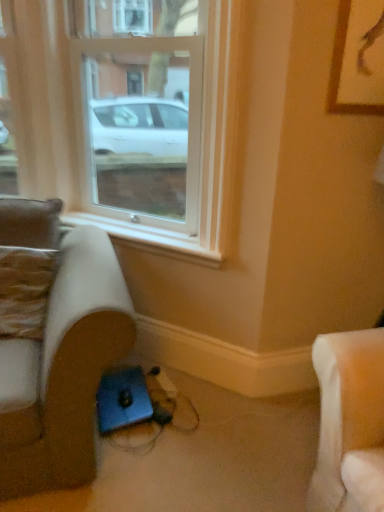
Find the location of a particular element. The width and height of the screenshot is (384, 512). suede-like beige studio couch at lower left is located at coordinates (63, 370).

The height and width of the screenshot is (512, 384). Describe the element at coordinates (150, 238) in the screenshot. I see `white plastic window sill at lower center` at that location.

Image resolution: width=384 pixels, height=512 pixels. Describe the element at coordinates (358, 59) in the screenshot. I see `wooden framed picture at upper right` at that location.

I want to click on clear glass window at center, so click(126, 117).

Considering the relative positions of wooden framed picture at upper right and clear glass window at center in the image provided, is wooden framed picture at upper right to the left of clear glass window at center from the viewer's perspective?

Incorrect, wooden framed picture at upper right is not on the left side of clear glass window at center.

Could you tell me if wooden framed picture at upper right is turned towards clear glass window at center?

No, wooden framed picture at upper right is not oriented towards clear glass window at center.

Considering the sizes of objects wooden framed picture at upper right and clear glass window at center in the image provided, who is taller, wooden framed picture at upper right or clear glass window at center?

clear glass window at center.

Which of these two, leather-like brown pillow at left or wooden framed picture at upper right, is smaller?

wooden framed picture at upper right.

From the image's perspective, which one is positioned lower, leather-like brown pillow at left or wooden framed picture at upper right?

leather-like brown pillow at left, from the image's perspective.

From a real-world perspective, between leather-like brown pillow at left and wooden framed picture at upper right, who is vertically lower?

From a 3D spatial view, leather-like brown pillow at left is below.

Does leather-like brown pillow at left lie behind wooden framed picture at upper right?

Yes, leather-like brown pillow at left is behind wooden framed picture at upper right.

Would you say leather-like brown pillow at left is inside or outside clear glass window at center?

leather-like brown pillow at left lies outside clear glass window at center.

Considering the sizes of objects leather-like brown pillow at left and clear glass window at center in the image provided, who is shorter, leather-like brown pillow at left or clear glass window at center?

With less height is leather-like brown pillow at left.

This screenshot has height=512, width=384. What are the coordinates of `window that is on the right side of leather-like brown pillow at left` in the screenshot? It's located at (126, 117).

Does leather-like brown pillow at left have a lesser width compared to clear glass window at center?

Indeed, leather-like brown pillow at left has a lesser width compared to clear glass window at center.

Looking at this image, considering the relative sizes of clear glass window at center and leather-like brown pillow at left in the image provided, is clear glass window at center shorter than leather-like brown pillow at left?

No, clear glass window at center is not shorter than leather-like brown pillow at left.

Would you say clear glass window at center is to the left or to the right of leather-like brown pillow at left in the picture?

clear glass window at center is positioned on leather-like brown pillow at left's right side.

Does clear glass window at center have a greater width compared to leather-like brown pillow at left?

Yes, clear glass window at center is wider than leather-like brown pillow at left.

Considering the points (95, 156) and (4, 283), which point is in front, point (95, 156) or point (4, 283)?

The point (4, 283) is closer.

Are white plastic window sill at lower center and clear glass window at center making contact?

No, white plastic window sill at lower center is not touching clear glass window at center.

Measure the distance from white plastic window sill at lower center to clear glass window at center.

11.66 inches.

Consider the image. Considering the relative positions of white plastic window sill at lower center and clear glass window at center in the image provided, is white plastic window sill at lower center to the right of clear glass window at center from the viewer's perspective?

No.

Which point is more forward, (x=166, y=249) or (x=86, y=56)?

The point (x=166, y=249) is more forward.

Image resolution: width=384 pixels, height=512 pixels. In order to click on window above the suede-like beige studio couch at lower left (from a real-world perspective) in this screenshot , I will do coord(126,117).

Is suede-like beige studio couch at lower left facing away from clear glass window at center?

No, suede-like beige studio couch at lower left is not facing the opposite direction of clear glass window at center.

From a real-world perspective, is suede-like beige studio couch at lower left over clear glass window at center?

No, from a real-world perspective, suede-like beige studio couch at lower left is not above clear glass window at center.

Which object is positioned more to the right, suede-like beige studio couch at lower left or clear glass window at center?

From the viewer's perspective, clear glass window at center appears more on the right side.

Is suede-like beige studio couch at lower left inside or outside of white plastic window sill at lower center?

suede-like beige studio couch at lower left is spatially situated outside white plastic window sill at lower center.

From a real-world perspective, is suede-like beige studio couch at lower left physically located above or below white plastic window sill at lower center?

suede-like beige studio couch at lower left is below white plastic window sill at lower center.

Which of these two, suede-like beige studio couch at lower left or white plastic window sill at lower center, is wider?

With larger width is suede-like beige studio couch at lower left.

Where is `picture frame behind the clear glass window at center`? picture frame behind the clear glass window at center is located at coordinates (358, 59).

Locate an element on the screen. This screenshot has height=512, width=384. picture frame on the right of leather-like brown pillow at left is located at coordinates (358, 59).

Looking at this image, looking at the image, which one is located further to leather-like brown pillow at left, suede-like beige studio couch at lower left or clear glass window at center?

clear glass window at center lies further to leather-like brown pillow at left than the other object.

Based on their spatial positions, is suede-like beige studio couch at lower left or white plastic window sill at lower center further from wooden framed picture at upper right?

suede-like beige studio couch at lower left is positioned further to the anchor wooden framed picture at upper right.

Looking at this image, based on their spatial positions, is suede-like beige studio couch at lower left or clear glass window at center closer to wooden framed picture at upper right?

The object closer to wooden framed picture at upper right is clear glass window at center.

Looking at this image, from the image, which object appears to be nearer to leather-like brown pillow at left, clear glass window at center or white plastic window sill at lower center?

The object closer to leather-like brown pillow at left is white plastic window sill at lower center.

Which object lies nearer to the anchor point leather-like brown pillow at left, suede-like beige studio couch at lower left or white plastic window sill at lower center?

suede-like beige studio couch at lower left lies closer to leather-like brown pillow at left than the other object.

When comparing their distances from wooden framed picture at upper right, does white plastic window sill at lower center or suede-like beige studio couch at lower left seem further?

suede-like beige studio couch at lower left is positioned further to the anchor wooden framed picture at upper right.

From the picture: Based on their spatial positions, is leather-like brown pillow at left or suede-like beige studio couch at lower left closer to clear glass window at center?

Among the two, leather-like brown pillow at left is located nearer to clear glass window at center.

When comparing their distances from white plastic window sill at lower center, does clear glass window at center or wooden framed picture at upper right seem closer?

clear glass window at center is closer to white plastic window sill at lower center.

Where is `pillow between clear glass window at center and suede-like beige studio couch at lower left vertically`? pillow between clear glass window at center and suede-like beige studio couch at lower left vertically is located at coordinates (25, 290).

You are a GUI agent. You are given a task and a screenshot of the screen. Output one action in this format:
    pyautogui.click(x=<x>, y=<y>)
    Task: Click on the window between leather-like brown pillow at left and wooden framed picture at upper right
    
    Given the screenshot: What is the action you would take?
    pyautogui.click(x=126, y=117)

The height and width of the screenshot is (512, 384). What are the coordinates of `window sill between leather-like brown pillow at left and wooden framed picture at upper right from left to right` in the screenshot? It's located at (150, 238).

This screenshot has height=512, width=384. What are the coordinates of `window sill between clear glass window at center and leather-like brown pillow at left in the vertical direction` in the screenshot? It's located at (150, 238).